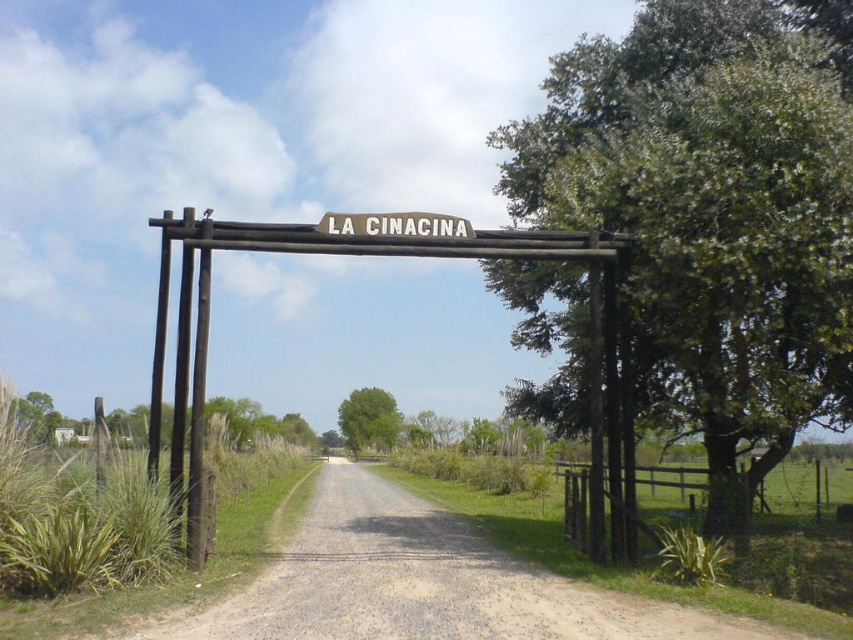
Question: Is green leafy tree at right bigger than white wooden sign at center?

Choices:
 (A) yes
 (B) no

Answer: (A)

Question: Among these objects, which one is farthest from the camera?

Choices:
 (A) white wooden sign at center
 (B) green leafy tree at right
 (C) green leafy tree at center
 (D) brown gravel dirt track at center

Answer: (C)

Question: Which point is closer to the camera?

Choices:
 (A) green leafy tree at center
 (B) green leafy tree at right
 (C) brown gravel dirt track at center

Answer: (C)

Question: From the image, what is the correct spatial relationship of white wooden sign at center in relation to green leafy tree at center?

Choices:
 (A) above
 (B) below

Answer: (A)

Question: Which is nearer to the white wooden sign at center?

Choices:
 (A) brown gravel dirt track at center
 (B) green leafy tree at right

Answer: (A)

Question: Can you confirm if white wooden sign at center is smaller than green leafy tree at center?

Choices:
 (A) no
 (B) yes

Answer: (B)